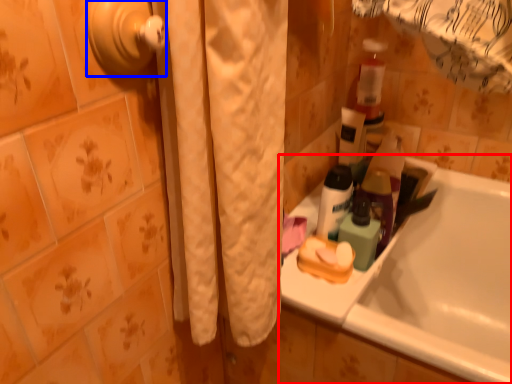
Question: Which object appears closest to the camera in this image, bathtub (highlighted by a red box) or door handle (highlighted by a blue box)?

Choices:
 (A) bathtub
 (B) door handle

Answer: (B)